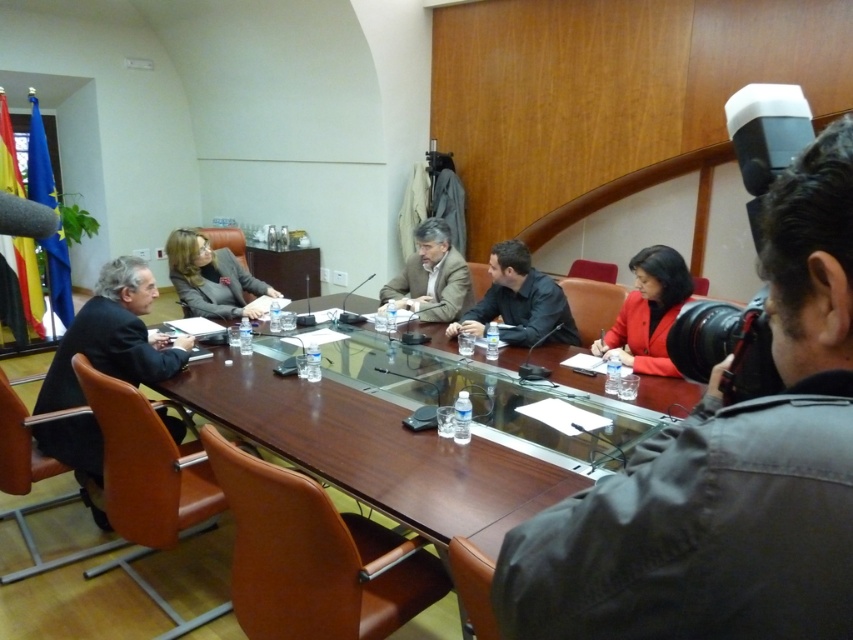
Is point (141, 307) closer to viewer compared to point (654, 248)?

No.

Is black fabric suit at left taller than matte red blazer at center?

Indeed, black fabric suit at left has a greater height compared to matte red blazer at center.

The image size is (853, 640). Describe the element at coordinates (113, 337) in the screenshot. I see `black fabric suit at left` at that location.

Find the location of a particular element. This screenshot has height=640, width=853. black fabric suit at left is located at coordinates (113, 337).

Is brown wooden table at center further to the viewer compared to matte black suit at center?

No, it is not.

Measure the distance between brown wooden table at center and matte black suit at center.

brown wooden table at center is 4.03 feet from matte black suit at center.

Locate an element on the screen. brown wooden table at center is located at coordinates (374, 449).

Which is more to the left, black leather jacket at center or matte brown jacket at center?

matte brown jacket at center

You are a GUI agent. You are given a task and a screenshot of the screen. Output one action in this format:
    pyautogui.click(x=<x>, y=<y>)
    Task: Click on the black leather jacket at center
    This screenshot has height=640, width=853.
    Given the screenshot: What is the action you would take?
    pyautogui.click(x=519, y=301)

Identify the location of black leather jacket at center. The width and height of the screenshot is (853, 640). pyautogui.click(x=519, y=301).